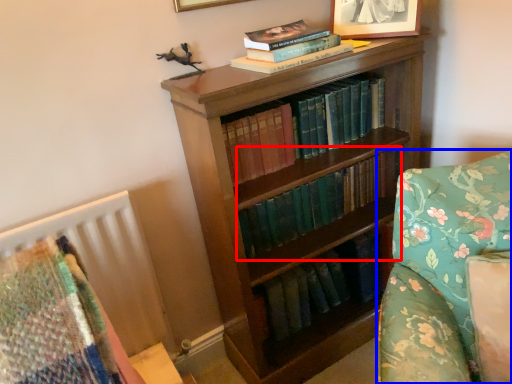
Question: Which object is further to the camera taking this photo, book (highlighted by a red box) or furniture (highlighted by a blue box)?

Choices:
 (A) book
 (B) furniture

Answer: (A)